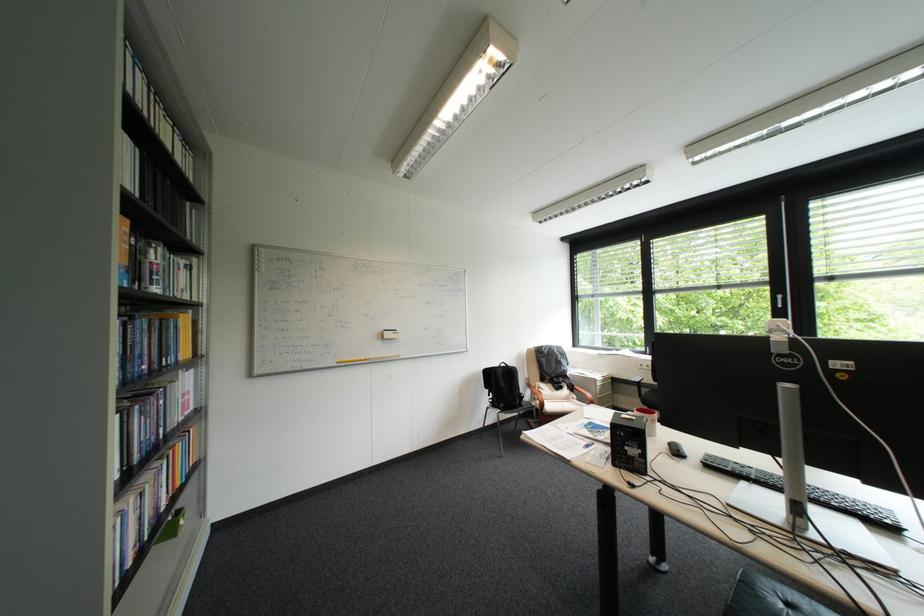
The width and height of the screenshot is (924, 616). I want to click on white window handle, so click(781, 305).